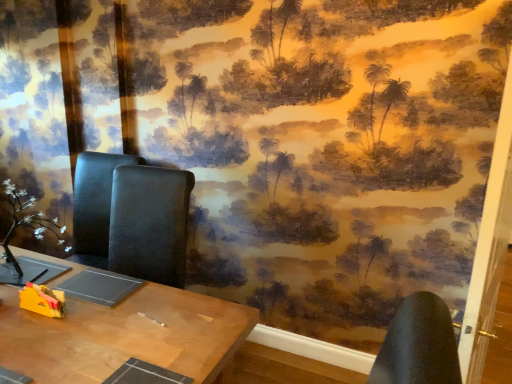
Identify the location of white matte flower at left. Image resolution: width=512 pixels, height=384 pixels. (28, 217).

Image resolution: width=512 pixels, height=384 pixels. I want to click on white matte flower at left, so click(28, 217).

Is yellow plastic toy at lower left shorter than white matte flower at left?

Yes, yellow plastic toy at lower left is shorter than white matte flower at left.

Considering the sizes of objects yellow plastic toy at lower left and white matte flower at left in the image provided, who is bigger, yellow plastic toy at lower left or white matte flower at left?

white matte flower at left.

Does yellow plastic toy at lower left lie in front of white matte flower at left?

Yes, it is.

Is point (20, 305) positioned before point (25, 212)?

Yes.

Between wooden table at center and white matte flower at left, which one appears on the right side from the viewer's perspective?

wooden table at center.

Is wooden table at center in contact with white matte flower at left?

No, wooden table at center is not with white matte flower at left.

Considering the relative sizes of wooden table at center and white matte flower at left in the image provided, is wooden table at center thinner than white matte flower at left?

No, wooden table at center is not thinner than white matte flower at left.

Which object is further away from the camera taking this photo, wooden table at center or white matte flower at left?

white matte flower at left is more distant.

Is wooden table at center completely or partially inside white matte flower at left?

No.

Based on their sizes in the image, would you say white matte flower at left is bigger or smaller than wooden table at center?

In the image, white matte flower at left appears to be smaller than wooden table at center.

This screenshot has height=384, width=512. I want to click on table to the right of white matte flower at left, so click(x=124, y=336).

Does wooden table at center appear on the left side of yellow plastic toy at lower left?

Indeed, wooden table at center is positioned on the left side of yellow plastic toy at lower left.

From the image's perspective, does wooden table at center appear lower than yellow plastic toy at lower left?

Indeed, from the image's perspective, wooden table at center is shown beneath yellow plastic toy at lower left.

Is point (2, 347) positioned in front of point (42, 293)?

Yes, point (2, 347) is in front of point (42, 293).

Find the location of a particular element. table below the yellow plastic toy at lower left (from a real-world perspective) is located at coordinates (124, 336).

Is point (22, 295) closer to camera compared to point (192, 303)?

No, it is behind (192, 303).

How much distance is there between yellow plastic toy at lower left and wooden table at center?

yellow plastic toy at lower left and wooden table at center are 9.89 inches apart.

What's the angular difference between yellow plastic toy at lower left and wooden table at center's facing directions?

2.58 degrees separate the facing orientations of yellow plastic toy at lower left and wooden table at center.

Could yellow plastic toy at lower left be considered to be inside white matte flower at left?

No, yellow plastic toy at lower left is not inside white matte flower at left.

From the image's perspective, is white matte flower at left located above yellow plastic toy at lower left?

Yes, from the image's perspective, white matte flower at left is above yellow plastic toy at lower left.

Which of these two, white matte flower at left or yellow plastic toy at lower left, is wider?

With larger width is white matte flower at left.

Is white matte flower at left further to camera compared to yellow plastic toy at lower left?

That is True.

You are a GUI agent. You are given a task and a screenshot of the screen. Output one action in this format:
    pyautogui.click(x=<x>, y=<y>)
    Task: Click on the toy beneath the white matte flower at left (from a real-world perspective)
    This screenshot has height=384, width=512.
    Given the screenshot: What is the action you would take?
    pyautogui.click(x=42, y=300)

Locate an element on the screen. table below the white matte flower at left (from the image's perspective) is located at coordinates (124, 336).

When comparing their distances from white matte flower at left, does yellow plastic toy at lower left or wooden table at center seem closer?

The object closer to white matte flower at left is yellow plastic toy at lower left.

When comparing their distances from wooden table at center, does white matte flower at left or yellow plastic toy at lower left seem further?

Based on the image, white matte flower at left appears to be further to wooden table at center.

Looking at the image, which one is located further to wooden table at center, yellow plastic toy at lower left or white matte flower at left?

white matte flower at left is positioned further to the anchor wooden table at center.

From the image, which object appears to be nearer to yellow plastic toy at lower left, wooden table at center or white matte flower at left?

wooden table at center is closer to yellow plastic toy at lower left.

When comparing their distances from white matte flower at left, does wooden table at center or yellow plastic toy at lower left seem closer?

Among the two, yellow plastic toy at lower left is located nearer to white matte flower at left.

Which object lies further to the anchor point yellow plastic toy at lower left, white matte flower at left or wooden table at center?

white matte flower at left is further to yellow plastic toy at lower left.

In order to click on toy between white matte flower at left and wooden table at center in the vertical direction in this screenshot , I will do `click(42, 300)`.